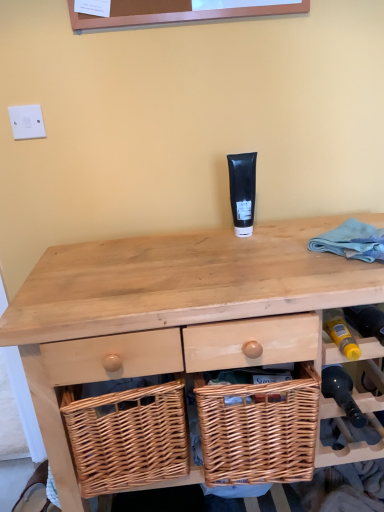
You are a GUI agent. You are given a task and a screenshot of the screen. Output one action in this format:
    pyautogui.click(x=<x>, y=<y>)
    Task: Click on the woven wood picnic basket at center
    This screenshot has width=384, height=512.
    Given the screenshot: What is the action you would take?
    pyautogui.click(x=259, y=429)

The height and width of the screenshot is (512, 384). Identify the location of woven wood basket at lower center. (128, 437).

What do you see at coordinates (242, 191) in the screenshot? This screenshot has width=384, height=512. I see `black matte tube at center` at bounding box center [242, 191].

What is the approximate height of natural wood desk at center?

natural wood desk at center is 33.67 inches in height.

What do you see at coordinates (27, 122) in the screenshot? The image size is (384, 512). I see `white plastic switch at upper left` at bounding box center [27, 122].

This screenshot has height=512, width=384. I want to click on white plastic switch at upper left, so click(27, 122).

What do you see at coordinates (345, 453) in the screenshot? I see `wooden wicker basket at lower right` at bounding box center [345, 453].

This screenshot has width=384, height=512. In order to click on woven wood picnic basket at center in this screenshot , I will do `click(259, 429)`.

Locate an element on the screen. This screenshot has width=384, height=512. basket on the left of natural wood desk at center is located at coordinates (128, 437).

How many degrees apart are the facing directions of natural wood desk at center and woven wood basket at lower center?

0.00261 degrees.

Choose the correct answer: Is natural wood desk at center inside woven wood basket at lower center or outside it?

natural wood desk at center exists outside the volume of woven wood basket at lower center.

Can you confirm if natural wood desk at center is positioned to the right of black matte tube at center?

Yes.

Is natural wood desk at center next to black matte tube at center and touching it?

natural wood desk at center and black matte tube at center are not in contact.

Can we say natural wood desk at center lies outside black matte tube at center?

natural wood desk at center lies outside black matte tube at center's area.

Based on their sizes in the image, would you say natural wood desk at center is bigger or smaller than black matte tube at center?

Clearly, natural wood desk at center is larger in size than black matte tube at center.

Considering the relative sizes of black matte tube at center and woven wood picnic basket at center in the image provided, is black matte tube at center shorter than woven wood picnic basket at center?

Yes.

Where is `toiletry behind the woven wood picnic basket at center`? This screenshot has width=384, height=512. toiletry behind the woven wood picnic basket at center is located at coordinates (242, 191).

Is point (247, 205) closer or farther from the camera than point (312, 401)?

Point (247, 205).

Which is behind, black matte tube at center or woven wood picnic basket at center?

Positioned behind is black matte tube at center.

Is black matte tube at center completely or partially outside of wooden wicker basket at lower right?

Yes, black matte tube at center is located beyond the bounds of wooden wicker basket at lower right.

Which is in front, black matte tube at center or wooden wicker basket at lower right?

wooden wicker basket at lower right is more forward.

Does point (241, 190) come behind point (344, 452)?

Yes, point (241, 190) is behind point (344, 452).

Is black matte tube at center smaller than wooden wicker basket at lower right?

Incorrect, black matte tube at center is not smaller in size than wooden wicker basket at lower right.

Based on the photo, would you consider woven wood basket at lower center to be distant from woven wood picnic basket at center?

woven wood basket at lower center is actually quite close to woven wood picnic basket at center.

Choose the correct answer: Is woven wood basket at lower center inside woven wood picnic basket at center or outside it?

woven wood basket at lower center is spatially situated outside woven wood picnic basket at center.

In the scene shown: Can you confirm if woven wood basket at lower center is thinner than woven wood picnic basket at center?

Yes.

Does point (174, 442) appear closer or farther from the camera than point (197, 409)?

Point (174, 442) appears to be farther away from the viewer than point (197, 409).

Which object is closer to the camera taking this photo, white plastic switch at upper left or woven wood picnic basket at center?

woven wood picnic basket at center is more forward.

From the image's perspective, between white plastic switch at upper left and woven wood picnic basket at center, which one is located above?

From the image's view, white plastic switch at upper left is above.

Is white plastic switch at upper left touching woven wood picnic basket at center?

No, white plastic switch at upper left is not next to woven wood picnic basket at center.

Can you confirm if black matte tube at center is positioned to the right of woven wood basket at lower center?

Correct, you'll find black matte tube at center to the right of woven wood basket at lower center.

Is the depth of black matte tube at center less than that of woven wood basket at lower center?

No, black matte tube at center is further to the viewer.

The image size is (384, 512). Identify the location of basket on the left of the natural wood desk at center. (128, 437).

This screenshot has width=384, height=512. Find the location of `toiletry that is above the natural wood desk at center (from a real-world perspective)`. toiletry that is above the natural wood desk at center (from a real-world perspective) is located at coordinates (242, 191).

Looking at the image, which one is located closer to black matte tube at center, woven wood basket at lower center or natural wood desk at center?

natural wood desk at center.

Considering their positions, is white plastic switch at upper left positioned further to woven wood picnic basket at center than wooden wicker basket at lower right?

white plastic switch at upper left is further to woven wood picnic basket at center.

From the image, which object appears to be farther from woven wood picnic basket at center, woven wood basket at lower center or black matte tube at center?

black matte tube at center is further to woven wood picnic basket at center.

Which object lies nearer to the anchor point wooden wicker basket at lower right, white plastic switch at upper left or woven wood picnic basket at center?

The object closer to wooden wicker basket at lower right is woven wood picnic basket at center.

Based on their spatial positions, is woven wood picnic basket at center or black matte tube at center further from wooden wicker basket at lower right?

black matte tube at center is further to wooden wicker basket at lower right.

Considering their positions, is white plastic switch at upper left positioned further to natural wood desk at center than woven wood picnic basket at center?

white plastic switch at upper left lies further to natural wood desk at center than the other object.

Considering their positions, is natural wood desk at center positioned closer to white plastic switch at upper left than woven wood basket at lower center?

The object closer to white plastic switch at upper left is natural wood desk at center.

Considering their positions, is wooden wicker basket at lower right positioned further to woven wood picnic basket at center than black matte tube at center?

The object further to woven wood picnic basket at center is black matte tube at center.

Where is `toiletry between white plastic switch at upper left and wooden wicker basket at lower right from left to right`? Image resolution: width=384 pixels, height=512 pixels. toiletry between white plastic switch at upper left and wooden wicker basket at lower right from left to right is located at coordinates (242, 191).

In order to click on toiletry between white plastic switch at upper left and woven wood picnic basket at center in the up-down direction in this screenshot , I will do `click(242, 191)`.

In order to click on basket between white plastic switch at upper left and wooden wicker basket at lower right from left to right in this screenshot , I will do `click(128, 437)`.

Locate an element on the screen. This screenshot has width=384, height=512. shelf that lies between white plastic switch at upper left and natural wood desk at center from top to bottom is located at coordinates (345, 453).